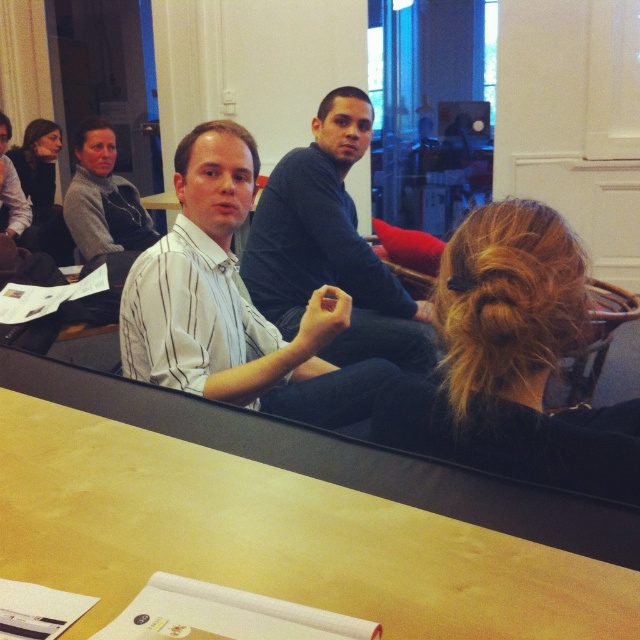
You are an observer looking at the scene. You notice the gray sweater at upper left and the matte black hair at upper left. Which object occupies more horizontal space in the image?

The matte black hair at upper left occupies more horizontal space than the gray sweater at upper left because the gray sweater at upper left has a lesser width compared to matte black hair at upper left.

Looking at the scene, where is the gray sweater at upper left positioned relative to the matte black hair at upper left?

The gray sweater at upper left is positioned to the right of matte black hair at upper left.